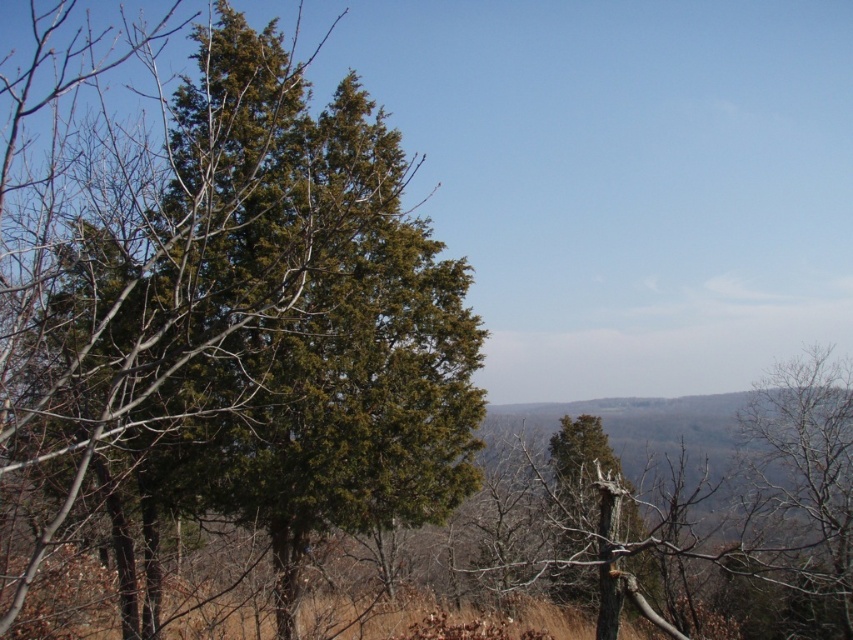
Can you confirm if green needle-like tree at left is wider than green leafy tree at center?

Incorrect, green needle-like tree at left's width does not surpass green leafy tree at center's.

Who is more distant from viewer, [225,35] or [779,464]?

The point [779,464] is more distant.

This screenshot has width=853, height=640. What are the coordinates of `green needle-like tree at left` in the screenshot? It's located at (263, 323).

Where is `green needle-like tree at left`? The height and width of the screenshot is (640, 853). green needle-like tree at left is located at coordinates (263, 323).